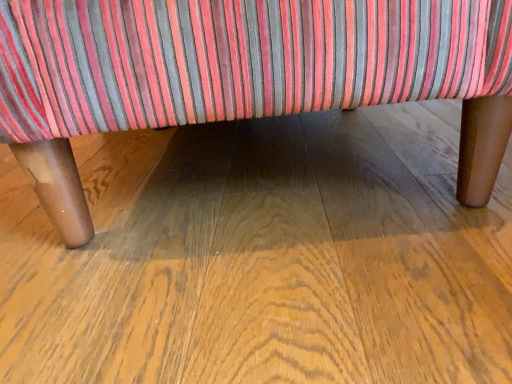
I want to click on velvet striped ottoman at center, so click(242, 74).

Describe the element at coordinates (242, 74) in the screenshot. I see `velvet striped ottoman at center` at that location.

Image resolution: width=512 pixels, height=384 pixels. Identify the location of velvet striped ottoman at center. (242, 74).